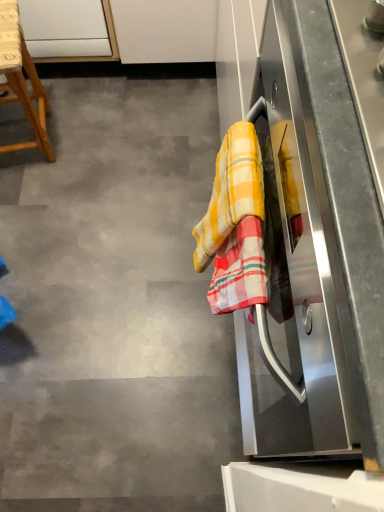
Question: Is yellow checkered towel at right far from yellow checkered towel at right?

Choices:
 (A) no
 (B) yes

Answer: (A)

Question: Can you confirm if yellow checkered towel at right is wider than yellow checkered towel at right?

Choices:
 (A) yes
 (B) no

Answer: (B)

Question: Considering the relative positions of yellow checkered towel at right and yellow checkered towel at right in the image provided, is yellow checkered towel at right in front of yellow checkered towel at right?

Choices:
 (A) no
 (B) yes

Answer: (B)

Question: Does yellow checkered towel at right have a larger size compared to yellow checkered towel at right?

Choices:
 (A) no
 (B) yes

Answer: (A)

Question: Can you confirm if yellow checkered towel at right is thinner than yellow checkered towel at right?

Choices:
 (A) no
 (B) yes

Answer: (B)

Question: Considering the relative positions of yellow checkered towel at right and yellow checkered towel at right in the image provided, is yellow checkered towel at right to the right of yellow checkered towel at right from the viewer's perspective?

Choices:
 (A) yes
 (B) no

Answer: (A)

Question: Is stainless steel oven at right looking in the opposite direction of yellow checkered towel at right?

Choices:
 (A) no
 (B) yes

Answer: (A)

Question: Does stainless steel oven at right have a greater width compared to yellow checkered towel at right?

Choices:
 (A) no
 (B) yes

Answer: (A)

Question: Can you confirm if stainless steel oven at right is bigger than yellow checkered towel at right?

Choices:
 (A) no
 (B) yes

Answer: (B)

Question: From a real-world perspective, is stainless steel oven at right located beneath yellow checkered towel at right?

Choices:
 (A) no
 (B) yes

Answer: (A)

Question: Does stainless steel oven at right appear on the left side of yellow checkered towel at right?

Choices:
 (A) no
 (B) yes

Answer: (A)

Question: From a real-world perspective, is stainless steel oven at right on top of yellow checkered towel at right?

Choices:
 (A) yes
 (B) no

Answer: (A)

Question: From a real-world perspective, is stainless steel oven at right on top of wooden stool at left?

Choices:
 (A) yes
 (B) no

Answer: (A)